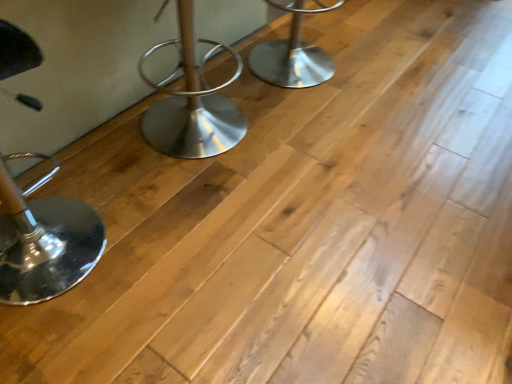
Where is `polished metal stool at center, the second furniture positioned from the left`? The height and width of the screenshot is (384, 512). polished metal stool at center, the second furniture positioned from the left is located at coordinates (293, 53).

What do you see at coordinates (293, 53) in the screenshot?
I see `polished metal stool at center, which ranks as the 2th furniture in front-to-back order` at bounding box center [293, 53].

How much space does polished metal stool at center, which is counted as the 1th furniture, starting from the back, occupy horizontally?

It is 51.81 centimeters.

The image size is (512, 384). What do you see at coordinates (44, 244) in the screenshot?
I see `polished chrome stool at left, which appears as the 1th furniture when viewed from the front` at bounding box center [44, 244].

Identify the location of polished chrome stool at left, the second furniture positioned from the top. (44, 244).

Where is `polished metal stool at center, which appears as the 1th furniture when viewed from the right`? Image resolution: width=512 pixels, height=384 pixels. polished metal stool at center, which appears as the 1th furniture when viewed from the right is located at coordinates (293, 53).

Does polished metal stool at center, which appears as the 1th furniture when viewed from the right, appear on the left side of polished chrome stool at left, positioned as the 1th furniture in left-to-right order?

No, polished metal stool at center, which appears as the 1th furniture when viewed from the right, is not to the left of polished chrome stool at left, positioned as the 1th furniture in left-to-right order.

Which object is further away from the camera taking this photo, polished metal stool at center, the first furniture when ordered from top to bottom, or polished chrome stool at left, the second furniture positioned from the top?

polished metal stool at center, the first furniture when ordered from top to bottom.

Does point (276, 46) appear closer or farther from the camera than point (44, 246)?

Clearly, point (276, 46) is more distant from the camera than point (44, 246).

From the image's perspective, would you say polished metal stool at center, marked as the 2th furniture in a bottom-to-top arrangement, is positioned over polished chrome stool at left, which is the second furniture in back-to-front order?

Yes.

From a real-world perspective, who is located higher, polished metal stool at center, marked as the 2th furniture in a bottom-to-top arrangement, or polished chrome stool at left, positioned as the 1th furniture in left-to-right order?

polished chrome stool at left, positioned as the 1th furniture in left-to-right order, from a real-world perspective.

Is polished metal stool at center, which ranks as the 2th furniture in front-to-back order, thinner than polished chrome stool at left, positioned as the 1th furniture in left-to-right order?

Incorrect, the width of polished metal stool at center, which ranks as the 2th furniture in front-to-back order, is not less than that of polished chrome stool at left, positioned as the 1th furniture in left-to-right order.

Does polished metal stool at center, marked as the 2th furniture in a bottom-to-top arrangement, have a lesser height compared to polished chrome stool at left, the second furniture positioned from the top?

Yes, polished metal stool at center, marked as the 2th furniture in a bottom-to-top arrangement, is shorter than polished chrome stool at left, the second furniture positioned from the top.

Looking at this image, is polished metal stool at center, which ranks as the 2th furniture in front-to-back order, bigger or smaller than polished chrome stool at left, which is the second furniture in back-to-front order?

polished metal stool at center, which ranks as the 2th furniture in front-to-back order, is smaller than polished chrome stool at left, which is the second furniture in back-to-front order.

Is polished metal stool at center, the second furniture positioned from the left, completely or partially outside of polished chrome stool at left, marked as the first furniture in a bottom-to-top arrangement?

polished metal stool at center, the second furniture positioned from the left, is positioned outside polished chrome stool at left, marked as the first furniture in a bottom-to-top arrangement.

Would you consider polished metal stool at center, the first furniture when ordered from top to bottom, to be distant from polished chrome stool at left, positioned as the 1th furniture in left-to-right order?

Indeed, polished metal stool at center, the first furniture when ordered from top to bottom, is not near polished chrome stool at left, positioned as the 1th furniture in left-to-right order.

Is polished chrome stool at left, which is the 2th furniture in right-to-left order, at the back of polished metal stool at center, which ranks as the 2th furniture in front-to-back order?

No, polished metal stool at center, which ranks as the 2th furniture in front-to-back order, is not facing the opposite direction of polished chrome stool at left, which is the 2th furniture in right-to-left order.

Can you tell me how much polished metal stool at center, which appears as the 1th furniture when viewed from the right, and polished chrome stool at left, which is the second furniture in back-to-front order, differ in facing direction?

polished metal stool at center, which appears as the 1th furniture when viewed from the right, and polished chrome stool at left, which is the second furniture in back-to-front order, are facing 6.21 degrees away from each other.

Measure the distance from polished metal stool at center, the first furniture when ordered from top to bottom, to polished chrome stool at left, which appears as the 1th furniture when viewed from the front.

The distance of polished metal stool at center, the first furniture when ordered from top to bottom, from polished chrome stool at left, which appears as the 1th furniture when viewed from the front, is 3.89 feet.

Locate an element on the screen. furniture that is on the right side of polished chrome stool at left, which is the 2th furniture in right-to-left order is located at coordinates (293, 53).

Does polished chrome stool at left, positioned as the 1th furniture in left-to-right order, appear on the right side of polished metal stool at center, which appears as the 1th furniture when viewed from the right?

No, polished chrome stool at left, positioned as the 1th furniture in left-to-right order, is not to the right of polished metal stool at center, which appears as the 1th furniture when viewed from the right.

Considering the relative positions of polished chrome stool at left, positioned as the 1th furniture in left-to-right order, and polished metal stool at center, which ranks as the 2th furniture in front-to-back order, in the image provided, is polished chrome stool at left, positioned as the 1th furniture in left-to-right order, behind polished metal stool at center, which ranks as the 2th furniture in front-to-back order,?

No, polished chrome stool at left, positioned as the 1th furniture in left-to-right order, is in front of polished metal stool at center, which ranks as the 2th furniture in front-to-back order.

Does point (40, 285) come behind point (280, 6)?

No, (40, 285) is in front of (280, 6).

From the picture: From the image's perspective, would you say polished chrome stool at left, positioned as the 1th furniture in left-to-right order, is positioned over polished metal stool at center, which ranks as the 2th furniture in front-to-back order?

No, from the image's perspective, polished chrome stool at left, positioned as the 1th furniture in left-to-right order, is not above polished metal stool at center, which ranks as the 2th furniture in front-to-back order.

From a real-world perspective, between polished chrome stool at left, marked as the first furniture in a bottom-to-top arrangement, and polished metal stool at center, which is counted as the 1th furniture, starting from the back, who is vertically higher?

In real-world perspective, polished chrome stool at left, marked as the first furniture in a bottom-to-top arrangement, is above.

Is polished chrome stool at left, which is the second furniture in back-to-front order, wider or thinner than polished metal stool at center, marked as the 2th furniture in a bottom-to-top arrangement?

polished chrome stool at left, which is the second furniture in back-to-front order, is thinner than polished metal stool at center, marked as the 2th furniture in a bottom-to-top arrangement.

Is polished chrome stool at left, which appears as the 1th furniture when viewed from the front, shorter than polished metal stool at center, which is counted as the 1th furniture, starting from the back?

No.

Considering the sizes of polished chrome stool at left, which is the 2th furniture in right-to-left order, and polished metal stool at center, which appears as the 1th furniture when viewed from the right, in the image, is polished chrome stool at left, which is the 2th furniture in right-to-left order, bigger or smaller than polished metal stool at center, which appears as the 1th furniture when viewed from the right,?

Clearly, polished chrome stool at left, which is the 2th furniture in right-to-left order, is larger in size than polished metal stool at center, which appears as the 1th furniture when viewed from the right.

Would you say polished chrome stool at left, which is the second furniture in back-to-front order, is outside polished metal stool at center, which appears as the 1th furniture when viewed from the right?

polished chrome stool at left, which is the second furniture in back-to-front order, lies outside polished metal stool at center, which appears as the 1th furniture when viewed from the right,'s area.

In the scene shown: Can you see polished chrome stool at left, positioned as the 1th furniture in left-to-right order, touching polished metal stool at center, the second furniture positioned from the left?

They are not placed beside each other.

Is polished chrome stool at left, which appears as the 1th furniture when viewed from the front, oriented towards polished metal stool at center, the first furniture when ordered from top to bottom?

No, polished chrome stool at left, which appears as the 1th furniture when viewed from the front, is not aimed at polished metal stool at center, the first furniture when ordered from top to bottom.

How different are the orientations of polished chrome stool at left, which appears as the 1th furniture when viewed from the front, and polished metal stool at center, which appears as the 1th furniture when viewed from the right, in degrees?

polished chrome stool at left, which appears as the 1th furniture when viewed from the front, and polished metal stool at center, which appears as the 1th furniture when viewed from the right, are facing 6.21 degrees away from each other.

Locate an element on the screen. The width and height of the screenshot is (512, 384). furniture that is on the left side of polished metal stool at center, the first furniture when ordered from top to bottom is located at coordinates (44, 244).

There is a polished metal stool at center, which is counted as the 1th furniture, starting from the back. Find the location of `furniture above it (from a real-world perspective)`. furniture above it (from a real-world perspective) is located at coordinates (44, 244).

You are a GUI agent. You are given a task and a screenshot of the screen. Output one action in this format:
    pyautogui.click(x=<x>, y=<y>)
    Task: Click on the furniture behind the polished chrome stool at left, positioned as the 1th furniture in left-to-right order
    The height and width of the screenshot is (384, 512).
    Given the screenshot: What is the action you would take?
    pyautogui.click(x=293, y=53)